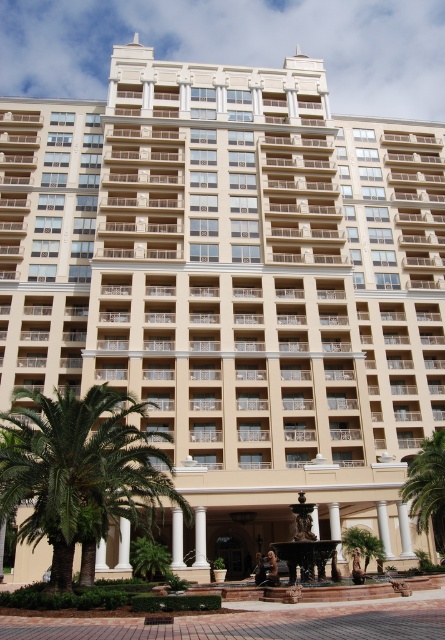
You are standing at the entrance of the building and want to walk towards the green leafy palm tree at lower left. Based on the coordinates provided in the Objects Description, in which general direction should you head?

The green leafy palm tree at lower left is located at point coordinates, so you should head towards the lower left direction from the entrance to reach it.